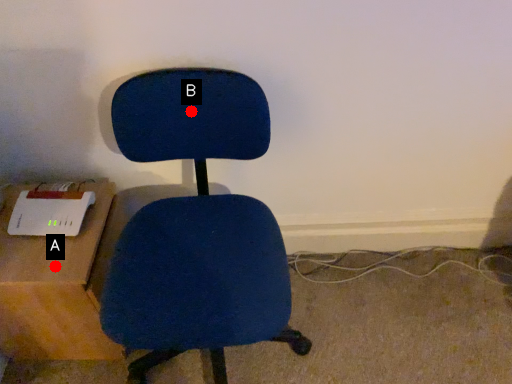
Question: Two points are circled on the image, labeled by A and B beside each circle. Which point is further to the camera?

Choices:
 (A) A is further
 (B) B is further

Answer: (A)